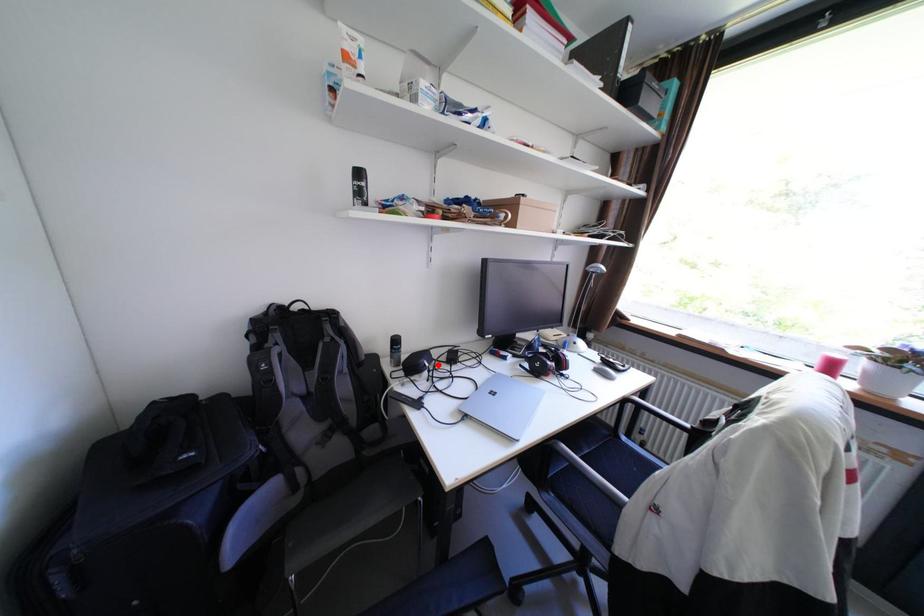
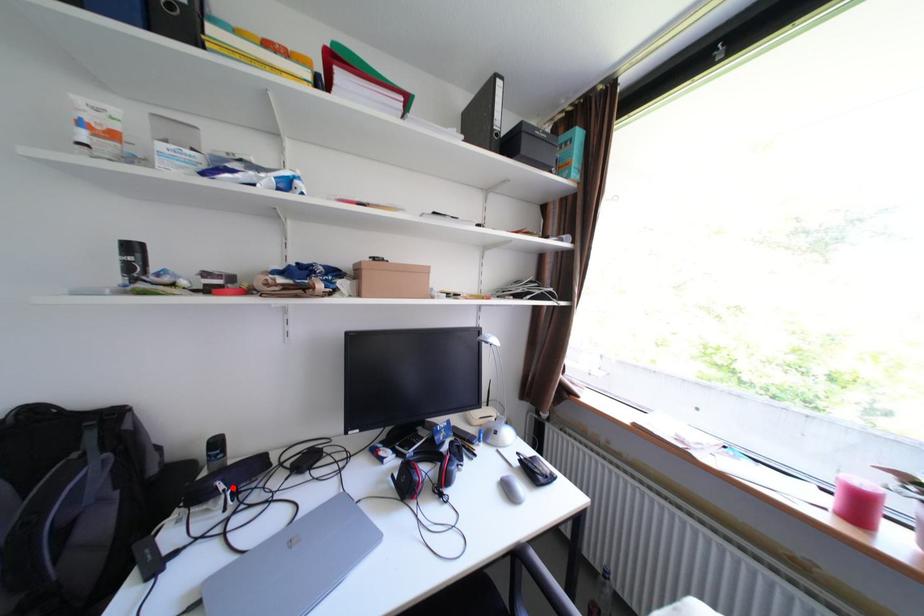
I am providing you with two images of the same scene from different viewpoints. A red point is marked on the first image and another point is marked on the second image. Does the point marked in image1 correspond to the same location as the one in image2?

Yes